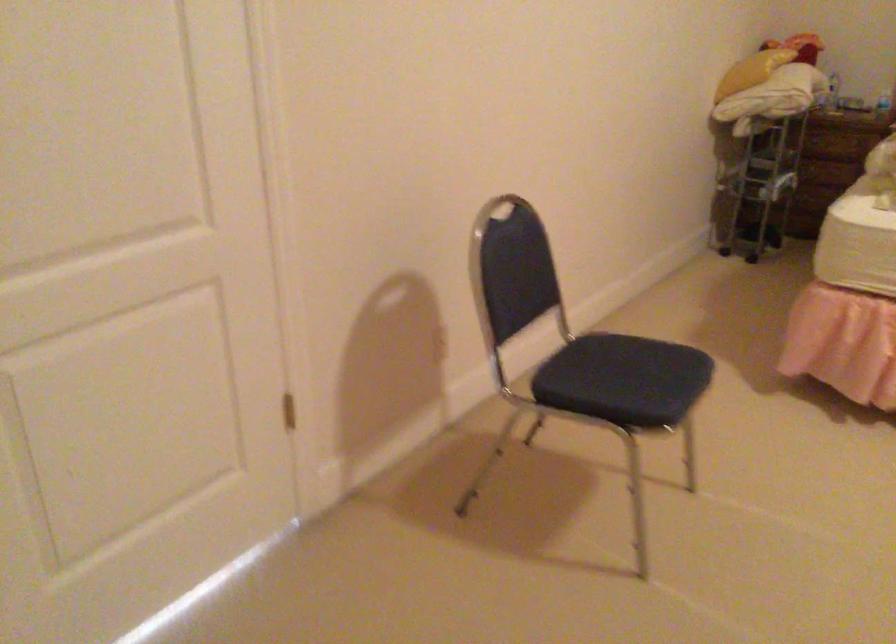
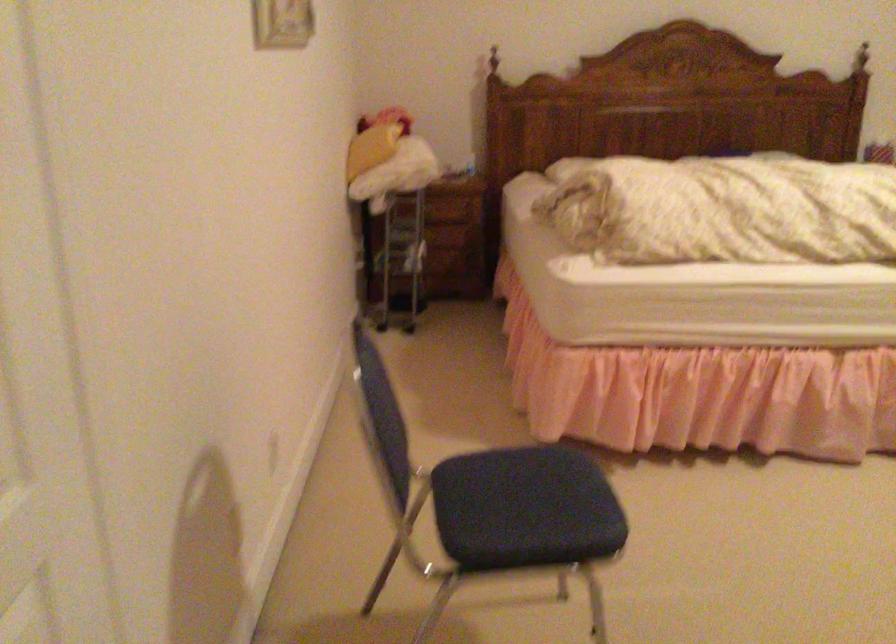
Question: The first image is from the beginning of the video and the second image is from the end. How did the camera likely rotate when shooting the video?

Choices:
 (A) Left
 (B) Right
 (C) Up
 (D) Down

Answer: (B)